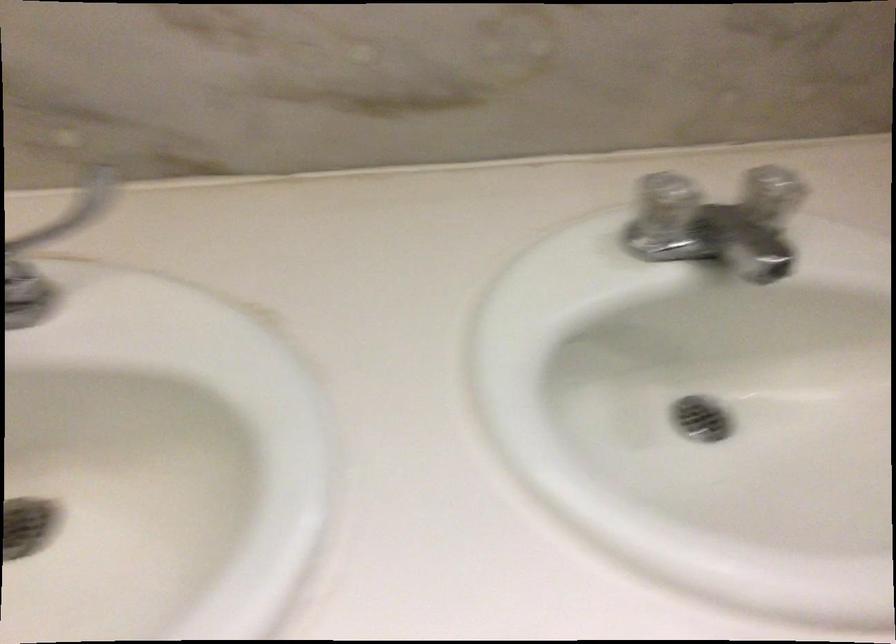
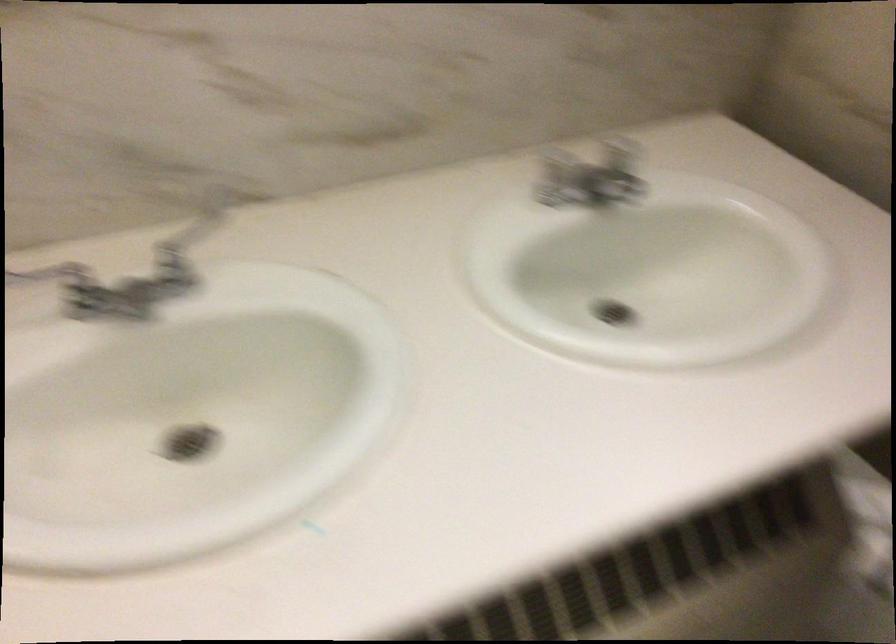
In the second image, find the point that corresponds to (x=109, y=194) in the first image.

(196, 225)